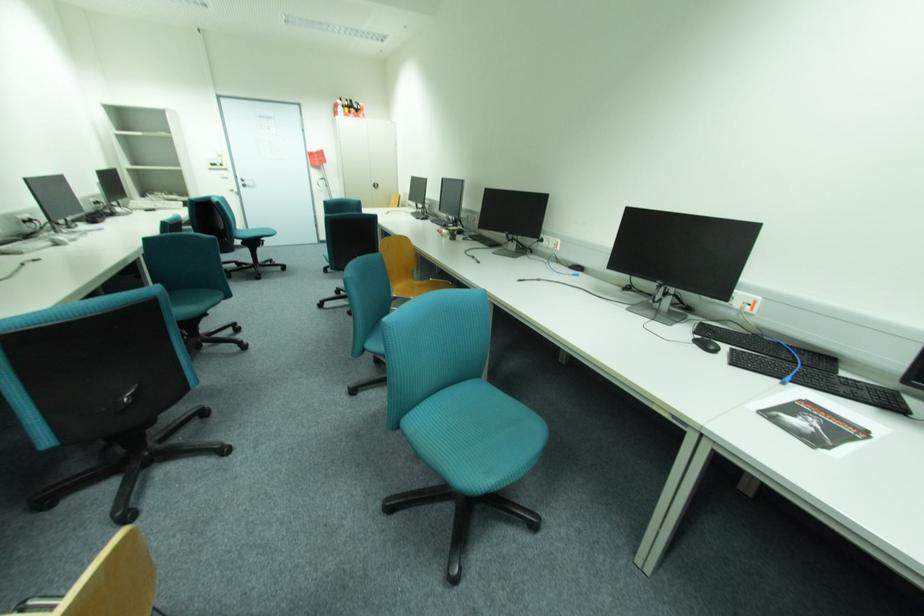
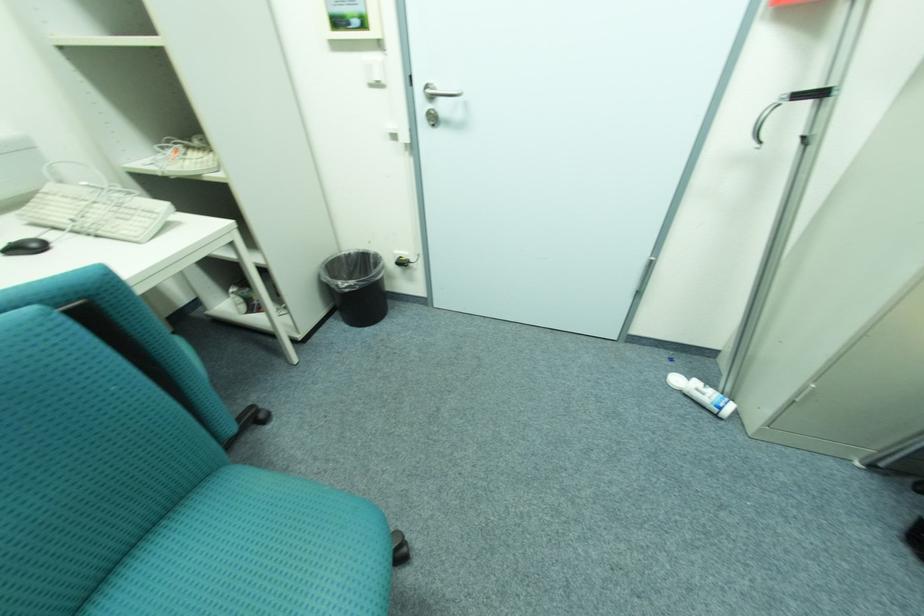
The point at (249, 180) is marked in the first image. Where is the corresponding point in the second image?

(439, 97)